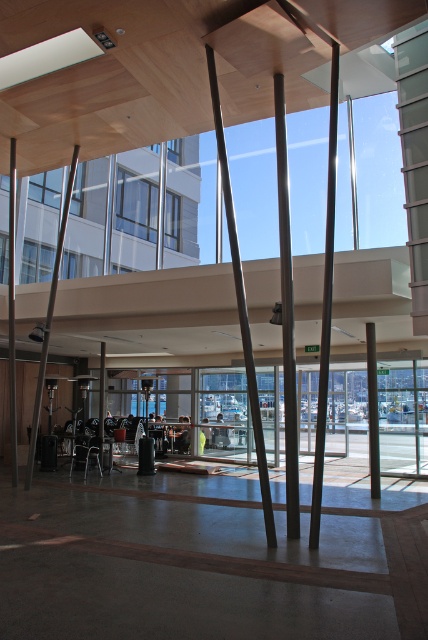
You are an architect designing a new exhibit space. You need to place a 4 meter long sculpture between the polished metal pole at center and the smooth gray pole at center. Will there be enough space to fit the sculpture between them?

The distance between the polished metal pole at center and the smooth gray pole at center is 4.27 meters, which is slightly longer than the 4 meter sculpture. Therefore, there is enough space to fit the sculpture between them.

You are standing in the atrium and want to take a photo of the smooth gray pole at center without the polished metal pole at center blocking it. How should you position yourself?

Move to a position where the polished metal pole at center is no longer between you and the smooth gray pole at center. Since the polished metal pole at center is in front of the smooth gray pole at center, you can move to the side to get an unobstructed view of the smooth gray pole at center.